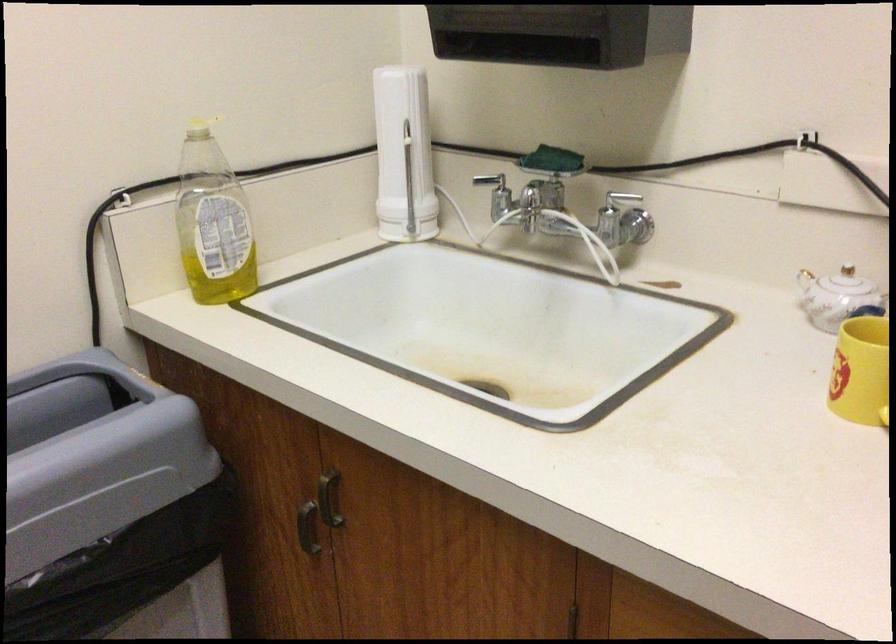
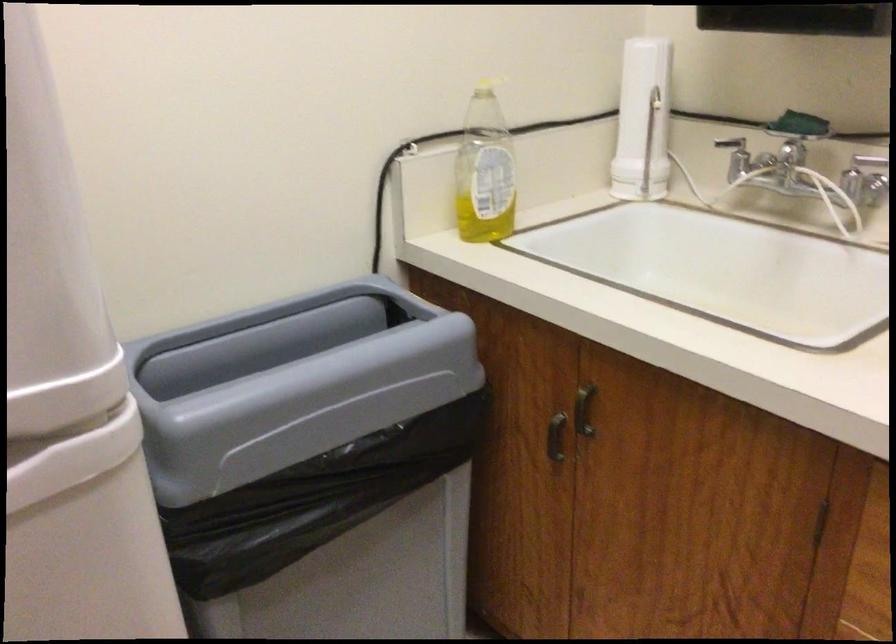
The images are taken continuously from a first-person perspective. In which direction are you moving?

The cameraman moved toward left, backward.